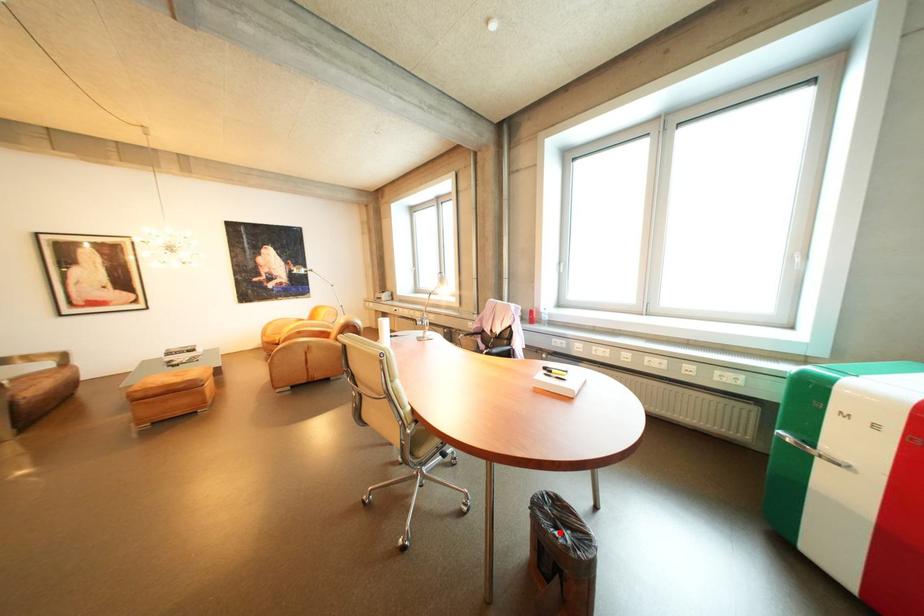
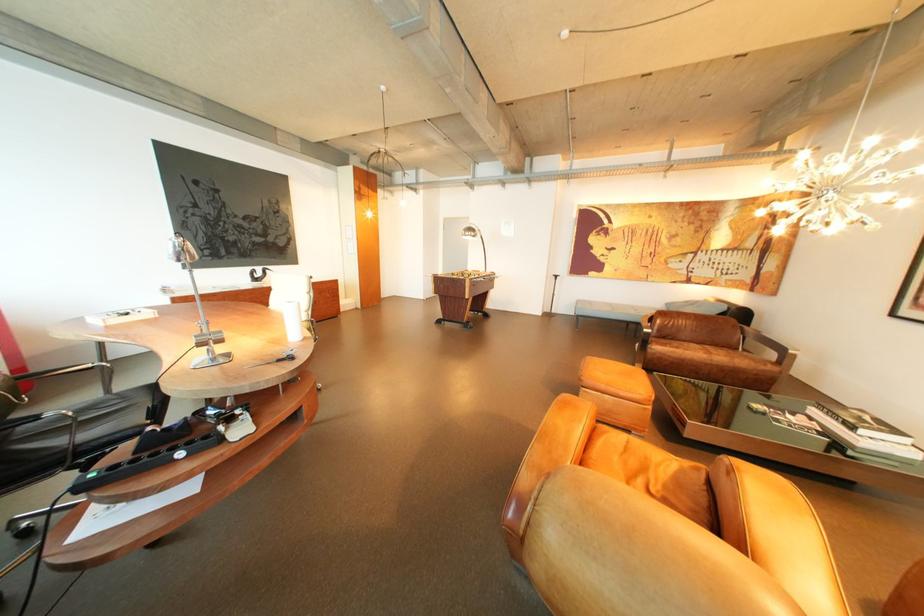
Question: I am providing you with two images of the same scene from different viewpoints. A red point is marked on the first image. At the location where the point appears in image 1, is it still visible in image 2?

Choices:
 (A) Yes
 (B) No

Answer: (B)